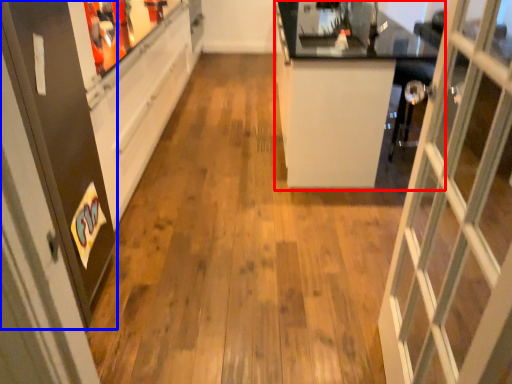
Question: Among these objects, which one is nearest to the camera, counter (highlighted by a red box) or screen door (highlighted by a blue box)?

Choices:
 (A) counter
 (B) screen door

Answer: (B)